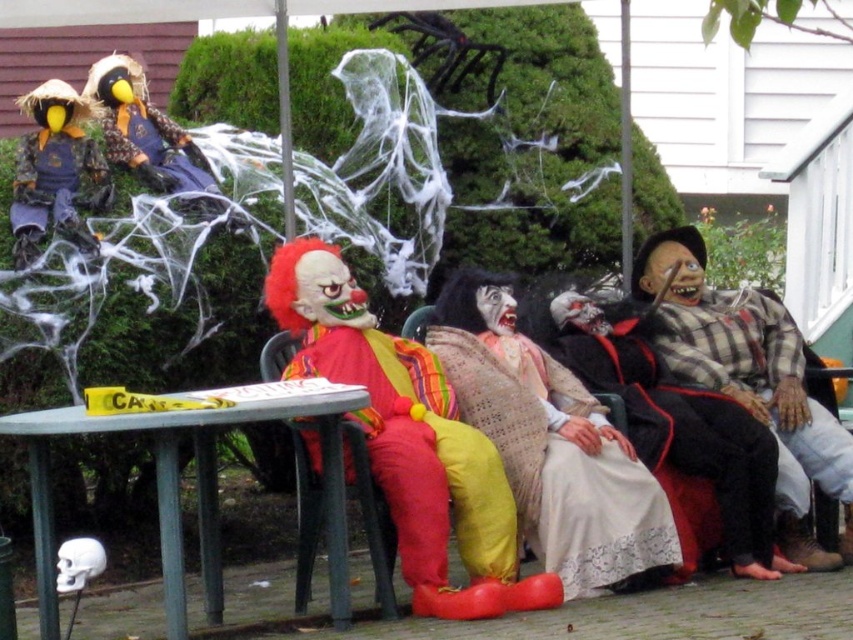
Based on the photo, you are standing in the Halloween scene and want to know how far the point at coordinates point [746,362] is from you. Can you determine the distance?

The distance of point [746,362] from camera is 5.35 meters.

You are a guest at a Halloween party and see the matte yellow scarecrow at upper left and the matte yellow and brown costume at upper left. Which one is placed higher up?

The matte yellow and brown costume at upper left is placed higher up than the matte yellow scarecrow at upper left.